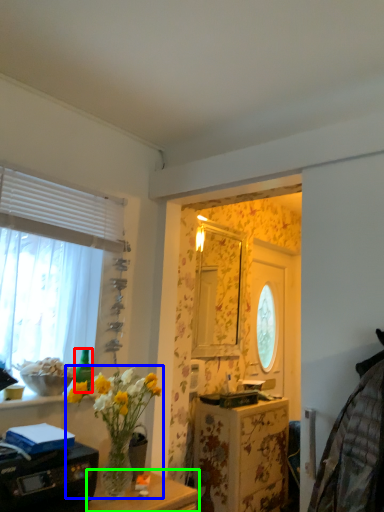
Question: Which object is positioned farthest from bottle (highlighted by a red box)? Select from houseplant (highlighted by a blue box) and table (highlighted by a green box).

Choices:
 (A) houseplant
 (B) table

Answer: (B)